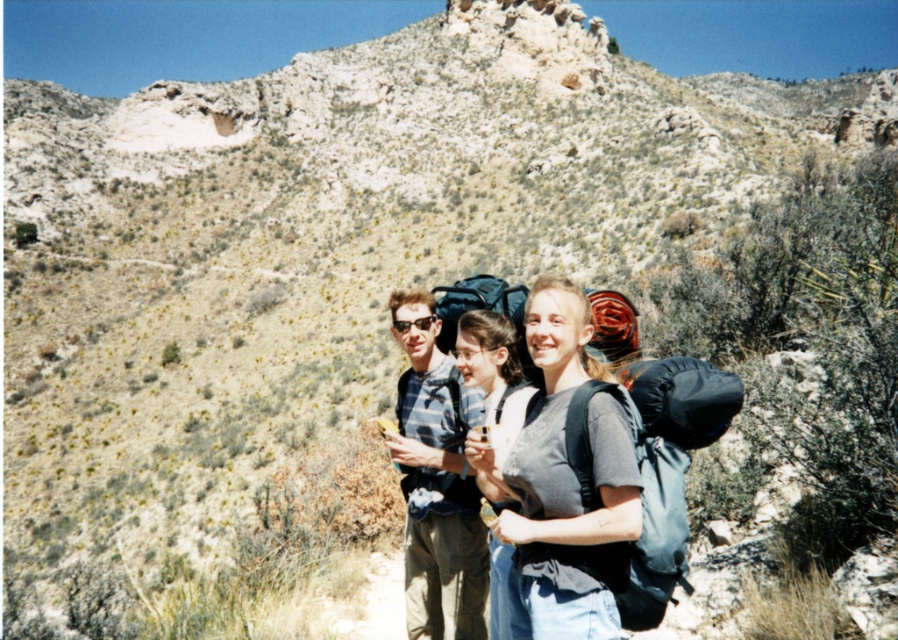
Based on the photo, you are a hiker planning to take a photo of the gray fabric backpack at center from the left side of the image. Based on its position at point (565, 484), would you need to move towards the right or left to get a clear view?

The gray fabric backpack at center is located at point (565, 484), so to get a clear view from the left side, you should move towards the left to align with the backpack.

Based on the photo, you are a hiker who wants to know if your gray fabric backpack at center is shorter than your blue plaid shirt at center. Based on the scene, can you confirm this?

The gray fabric backpack at center has a lesser height compared to the blue plaid shirt at center, so yes, the gray fabric backpack at center is shorter than the blue plaid shirt at center.